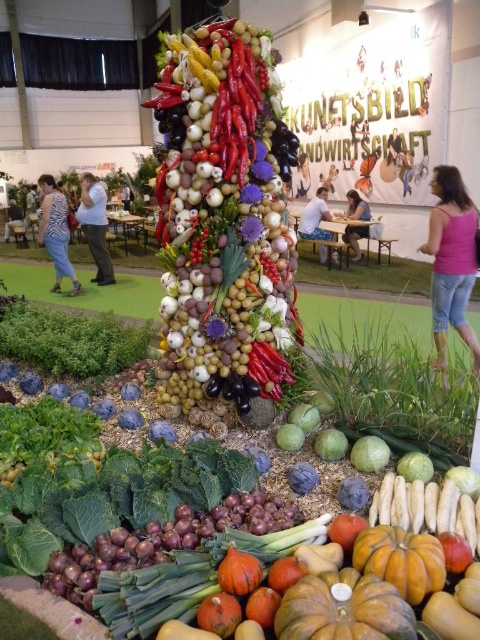
Is zebra-striped shirt at left thinner than light blue jeans at left?

Yes, zebra-striped shirt at left is thinner than light blue jeans at left.

Which is more to the right, zebra-striped shirt at left or light blue jeans at left?

zebra-striped shirt at left

Which is in front, point (55, 198) or point (12, 216)?

Point (55, 198) is more forward.

In order to click on zebra-striped shirt at left in this screenshot , I will do `click(56, 230)`.

How far apart are shiny red pepper at center and light blue jeans at left?

shiny red pepper at center and light blue jeans at left are 42.91 feet apart.

Measure the distance between point (222, 237) and camera.

Point (222, 237) is 7.98 feet from camera.

You are a GUI agent. You are given a task and a screenshot of the screen. Output one action in this format:
    pyautogui.click(x=<x>, y=<y>)
    Task: Click on the shiny red pepper at center
    This screenshot has width=480, height=640.
    Given the screenshot: What is the action you would take?
    pyautogui.click(x=224, y=218)

Can you confirm if shiny red pepper at center is taller than matte white blouse at center?

Yes, shiny red pepper at center is taller than matte white blouse at center.

Does shiny red pepper at center lie in front of matte white blouse at center?

Yes.

Locate an element on the screen. shiny red pepper at center is located at coordinates (224, 218).

Identify the location of shiny red pepper at center. (224, 218).